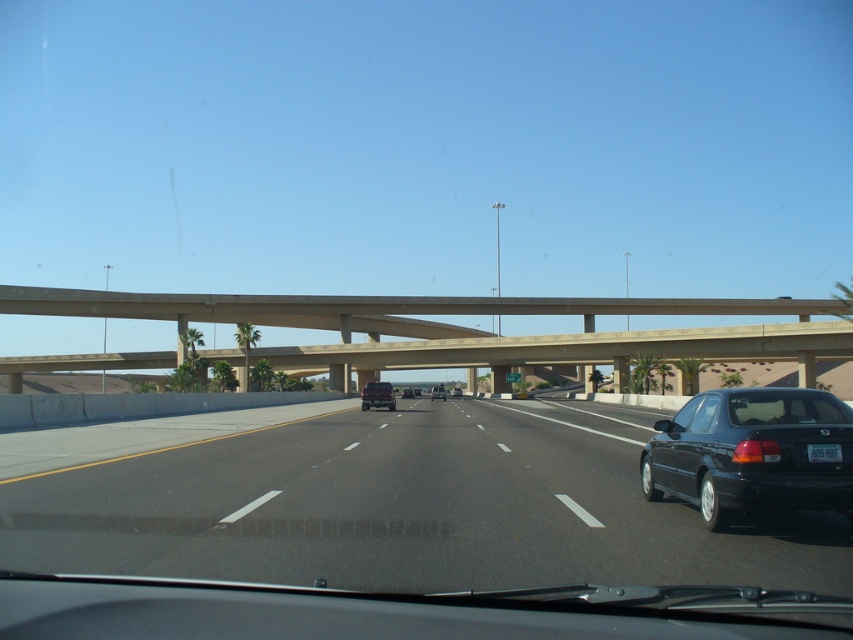
You are driving a car that is 15 feet long. You see the black asphalt highway at center and the black glossy sedan at center ahead of you. If you want to overtake the sedan, how much distance do you need to safely pass it on the highway?

The black asphalt highway at center is 325.19 feet from the black glossy sedan at center. To safely overtake the sedan, you should allow for the length of your car plus a sufficient buffer distance, so you need at least 325.19 feet plus the length of your car, which is 15 feet, totaling 340.19 feet of clear distance ahead to ensure a safe pass.

Consider the image. You are driving a car and want to know if you can see the concrete bridge at center through the transparent glass windshield at center. Based on their positions, can you see the bridge through the windshield?

The concrete bridge at center and transparent glass windshield at center are 301.94 feet apart. Since the windshield is in front of the driver and the bridge is far ahead, you can see the concrete bridge at center through the transparent glass windshield at center as they are aligned along the same line of sight.